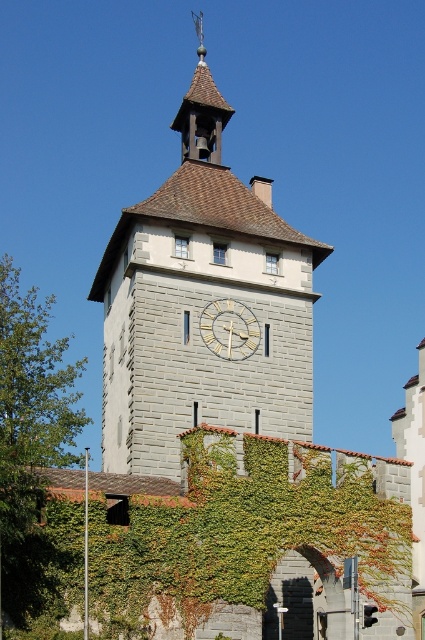
Question: In this image, where is gray stone clock tower at center located relative to white wooden clock at center?

Choices:
 (A) above
 (B) below

Answer: (A)

Question: Which object is positioned farthest from the green ivy at center?

Choices:
 (A) gray stone clock tower at center
 (B) white wooden clock at center

Answer: (B)

Question: Is polished copper bell at upper center closer to the viewer compared to white wooden clock at center?

Choices:
 (A) yes
 (B) no

Answer: (B)

Question: Is gray stone clock tower at center positioned in front of green ivy at center?

Choices:
 (A) no
 (B) yes

Answer: (A)

Question: Which point appears closest to the camera in this image?

Choices:
 (A) (124, 612)
 (B) (243, 243)
 (C) (218, 144)
 (D) (229, 337)

Answer: (A)

Question: Which object is farther from the camera taking this photo?

Choices:
 (A) green ivy at center
 (B) gray stone clock tower at center
 (C) white wooden clock at center
 (D) polished copper bell at upper center

Answer: (D)